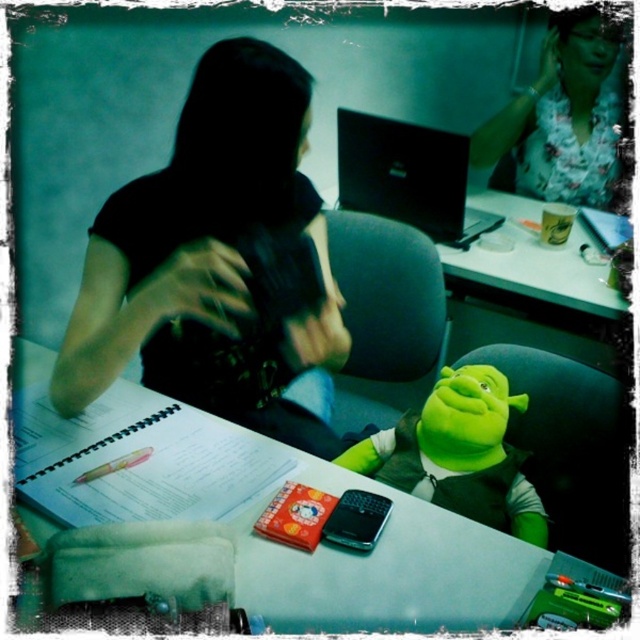
Question: Does floral fabric shirt at upper right appear on the left side of white plastic table at upper center?

Choices:
 (A) no
 (B) yes

Answer: (A)

Question: Which is nearer to the white plastic table at upper center?

Choices:
 (A) matte black hoodie at upper left
 (B) black glossy laptop at center
 (C) green plush toy at center

Answer: (B)

Question: Which of the following is the closest to the observer?

Choices:
 (A) green plush toy at center
 (B) black glossy laptop at center
 (C) black plastic phone at center
 (D) white plastic table at upper center

Answer: (C)

Question: Can you confirm if white plastic table at upper center is thinner than black plastic phone at center?

Choices:
 (A) no
 (B) yes

Answer: (A)

Question: Estimate the real-world distances between objects in this image. Which object is closer to the white plastic table at upper center?

Choices:
 (A) green plush toy at center
 (B) matte blue notepad at upper right
 (C) matte black hoodie at upper left

Answer: (B)

Question: Is floral fabric shirt at upper right smaller than matte blue notepad at upper right?

Choices:
 (A) yes
 (B) no

Answer: (B)